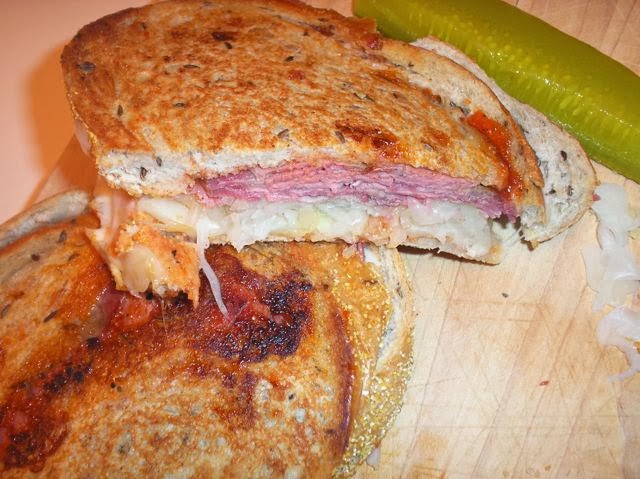
You are a GUI agent. You are given a task and a screenshot of the screen. Output one action in this format:
    pyautogui.click(x=<x>, y=<y>)
    Task: Click on the wall
    This screenshot has width=640, height=479.
    Given the screenshot: What is the action you would take?
    pyautogui.click(x=22, y=33)